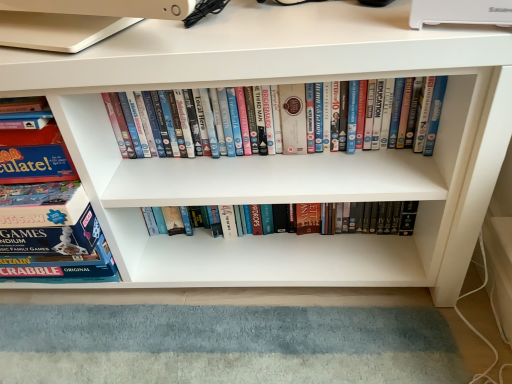
Question: Which is correct: white glossy dvds at center, marked as the first book in a right-to-left arrangement, is inside blue cardboard game box at left, the first book from the left, or outside of it?

Choices:
 (A) inside
 (B) outside

Answer: (B)

Question: From their relative heights in the image, would you say white glossy dvds at center, the 2th book positioned from the left, is taller or shorter than blue cardboard game box at left, which is the second book in right-to-left order?

Choices:
 (A) tall
 (B) short

Answer: (B)

Question: Based on their positions, is white glossy dvds at center, the 2th book positioned from the left, located to the left or right of blue cardboard game box at left, which is the second book in right-to-left order?

Choices:
 (A) right
 (B) left

Answer: (A)

Question: Is point (24, 168) positioned closer to the camera than point (406, 140)?

Choices:
 (A) closer
 (B) farther

Answer: (A)

Question: From a real-world perspective, relative to white glossy dvds at center, marked as the first book in a right-to-left arrangement, is blue cardboard game box at left, which is the second book in right-to-left order, vertically above or below?

Choices:
 (A) above
 (B) below

Answer: (B)

Question: From their relative heights in the image, would you say blue cardboard game box at left, the first book from the left, is taller or shorter than white glossy dvds at center, marked as the first book in a right-to-left arrangement?

Choices:
 (A) tall
 (B) short

Answer: (A)

Question: Based on their positions, is blue cardboard game box at left, which is the second book in right-to-left order, located to the left or right of white glossy dvds at center, the 2th book positioned from the left?

Choices:
 (A) right
 (B) left

Answer: (B)